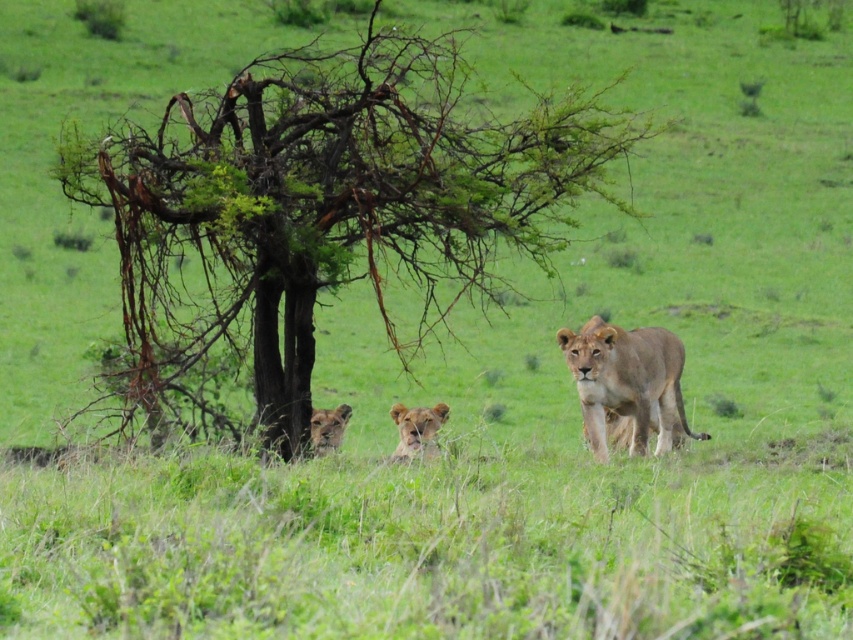
Question: Can you confirm if green leafy tree at center is positioned to the right of golden brown fur lion at center?

Choices:
 (A) yes
 (B) no

Answer: (B)

Question: Considering the real-world distances, which object is farthest from the golden fur lion at center?

Choices:
 (A) golden fur lion at lower center
 (B) green leafy tree at center

Answer: (B)

Question: Which point is farther to the camera?

Choices:
 (A) (418, 221)
 (B) (666, 442)
 (C) (344, 419)
 (D) (405, 448)

Answer: (C)

Question: Can you confirm if golden brown fur lion at center is smaller than golden fur lion at lower center?

Choices:
 (A) yes
 (B) no

Answer: (B)

Question: Considering the relative positions of golden fur lion at center and golden fur lion at lower center in the image provided, where is golden fur lion at center located with respect to golden fur lion at lower center?

Choices:
 (A) below
 (B) above

Answer: (A)

Question: Which point is closer to the camera?

Choices:
 (A) golden fur lion at lower center
 (B) golden fur lion at center

Answer: (B)